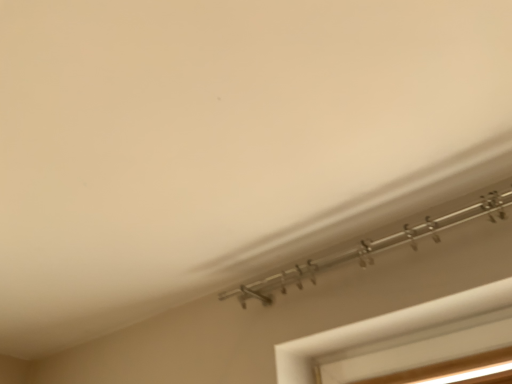
Where is `metallic silver hooks at upper center`? The image size is (512, 384). metallic silver hooks at upper center is located at coordinates (369, 249).

What is the approximate height of metallic silver hooks at upper center?

The height of metallic silver hooks at upper center is 2.67 inches.

What do you see at coordinates (369, 249) in the screenshot? The height and width of the screenshot is (384, 512). I see `metallic silver hooks at upper center` at bounding box center [369, 249].

At what (x,y) coordinates should I click in order to perform the action: click on metallic silver hooks at upper center. Please return your answer as a coordinate pair (x, y). Looking at the image, I should click on (369, 249).